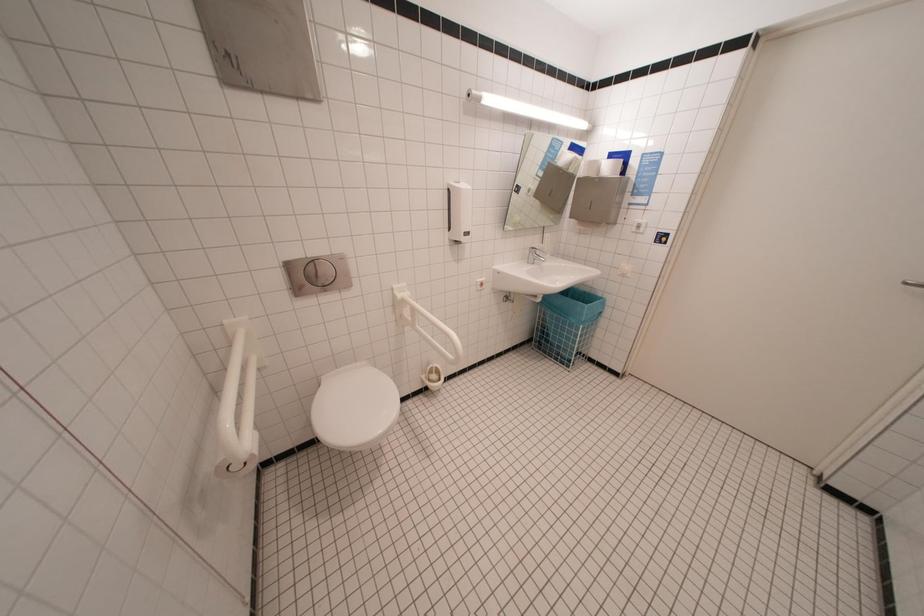
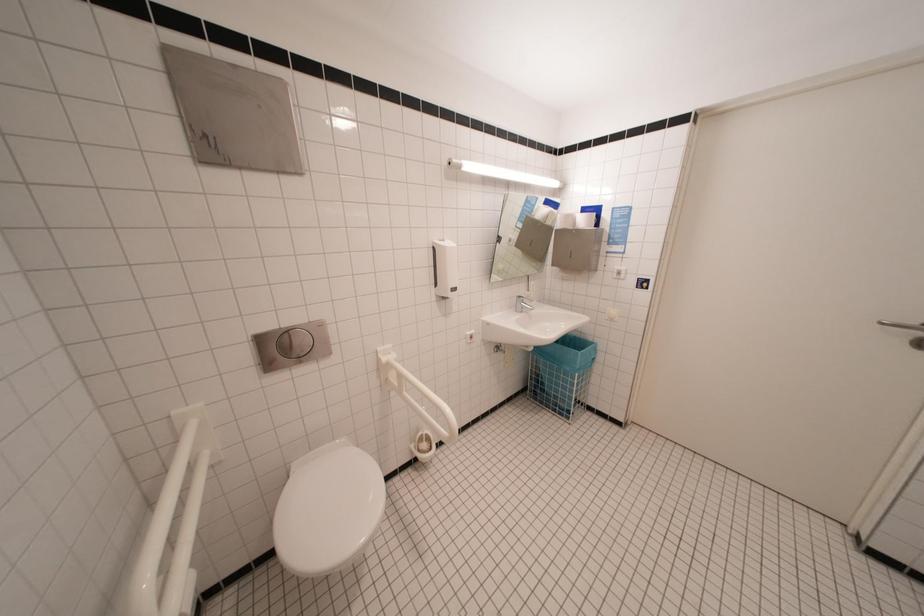
Question: The first image is from the beginning of the video and the second image is from the end. How did the camera likely rotate when shooting the video?

Choices:
 (A) Left
 (B) Right
 (C) Up
 (D) Down

Answer: (C)